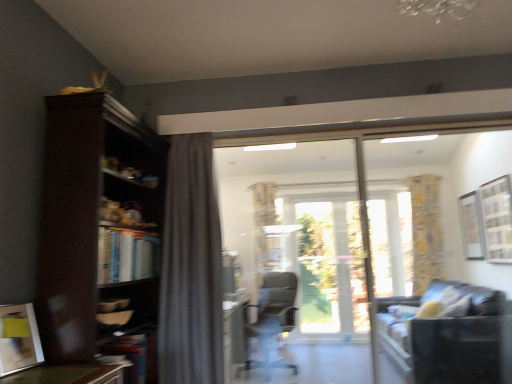
Question: Is clear glass window at upper right at the left side of yellow floral fabric curtain at right, which is the 2th curtain in left-to-right order?

Choices:
 (A) no
 (B) yes

Answer: (A)

Question: From the image's perspective, does clear glass window at upper right appear lower than yellow floral fabric curtain at right, which is the 2th curtain in left-to-right order?

Choices:
 (A) no
 (B) yes

Answer: (A)

Question: From a real-world perspective, is clear glass window at upper right positioned under yellow floral fabric curtain at right, which is the 2th curtain in left-to-right order, based on gravity?

Choices:
 (A) yes
 (B) no

Answer: (B)

Question: Does clear glass window at upper right have a greater height compared to yellow floral fabric curtain at right, which is counted as the 1th curtain, starting from the back?

Choices:
 (A) yes
 (B) no

Answer: (B)

Question: Is clear glass window at upper right further to the viewer compared to yellow floral fabric curtain at right, which is counted as the 1th curtain, starting from the back?

Choices:
 (A) yes
 (B) no

Answer: (B)

Question: Relative to dark gray textured curtain at center, the second curtain when ordered from right to left, is transparent glass door at center in front or behind?

Choices:
 (A) behind
 (B) front

Answer: (A)

Question: Considering the relative positions of transparent glass door at center and dark gray textured curtain at center, the second curtain when ordered from right to left, in the image provided, is transparent glass door at center to the left or to the right of dark gray textured curtain at center, the second curtain when ordered from right to left,?

Choices:
 (A) left
 (B) right

Answer: (B)

Question: Is transparent glass door at center inside the boundaries of dark gray textured curtain at center, the second curtain when ordered from right to left, or outside?

Choices:
 (A) outside
 (B) inside

Answer: (A)

Question: Does point (351, 241) appear closer or farther from the camera than point (187, 211)?

Choices:
 (A) closer
 (B) farther

Answer: (B)

Question: From the image's perspective, relative to matte gray office chair at center, is clear glass window at upper right above or below?

Choices:
 (A) below
 (B) above

Answer: (B)

Question: Is clear glass window at upper right to the left or to the right of matte gray office chair at center in the image?

Choices:
 (A) right
 (B) left

Answer: (A)

Question: Is clear glass window at upper right bigger or smaller than matte gray office chair at center?

Choices:
 (A) small
 (B) big

Answer: (A)

Question: Considering their positions, is clear glass window at upper right located in front of or behind matte gray office chair at center?

Choices:
 (A) front
 (B) behind

Answer: (A)

Question: From a real-world perspective, relative to white matte picture frame at upper right, acting as the second picture frame starting from the left, is matte yellow picture frame at lower left, the second picture frame from the back, vertically above or below?

Choices:
 (A) below
 (B) above

Answer: (A)

Question: Looking at the image, does matte yellow picture frame at lower left, the first picture frame when ordered from left to right, seem bigger or smaller compared to white matte picture frame at upper right, acting as the second picture frame starting from the left?

Choices:
 (A) small
 (B) big

Answer: (A)